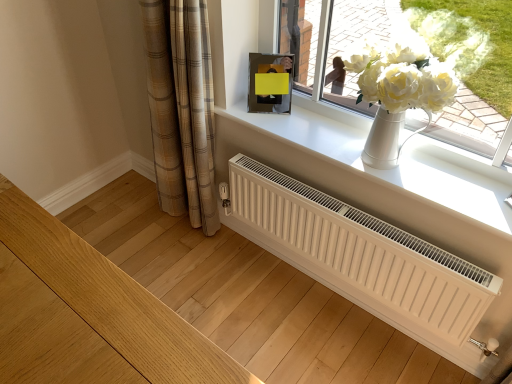
Question: Which direction should I rotate to look at metallic reflective picture frame at upper center?

Choices:
 (A) left
 (B) right

Answer: (B)

Question: Is white matte radiator at center outside of metallic reflective picture frame at upper center?

Choices:
 (A) no
 (B) yes

Answer: (B)

Question: From a real-world perspective, is white matte radiator at center below metallic reflective picture frame at upper center?

Choices:
 (A) no
 (B) yes

Answer: (B)

Question: Can you confirm if white matte radiator at center is positioned to the right of metallic reflective picture frame at upper center?

Choices:
 (A) yes
 (B) no

Answer: (A)

Question: Considering the relative positions of white matte radiator at center and metallic reflective picture frame at upper center in the image provided, is white matte radiator at center behind metallic reflective picture frame at upper center?

Choices:
 (A) no
 (B) yes

Answer: (A)

Question: Is white matte radiator at center facing away from metallic reflective picture frame at upper center?

Choices:
 (A) no
 (B) yes

Answer: (A)

Question: Considering the relative sizes of white matte radiator at center and metallic reflective picture frame at upper center in the image provided, is white matte radiator at center smaller than metallic reflective picture frame at upper center?

Choices:
 (A) yes
 (B) no

Answer: (B)

Question: Is white ceramic vase at upper center turned away from white smooth window sill at upper center?

Choices:
 (A) yes
 (B) no

Answer: (B)

Question: Considering the relative sizes of white ceramic vase at upper center and white smooth window sill at upper center in the image provided, is white ceramic vase at upper center thinner than white smooth window sill at upper center?

Choices:
 (A) no
 (B) yes

Answer: (B)

Question: From the image's perspective, is white ceramic vase at upper center located beneath white smooth window sill at upper center?

Choices:
 (A) yes
 (B) no

Answer: (B)

Question: Considering the relative sizes of white ceramic vase at upper center and white smooth window sill at upper center in the image provided, is white ceramic vase at upper center shorter than white smooth window sill at upper center?

Choices:
 (A) no
 (B) yes

Answer: (A)

Question: Is white ceramic vase at upper center oriented towards white smooth window sill at upper center?

Choices:
 (A) yes
 (B) no

Answer: (A)

Question: Considering the relative sizes of white ceramic vase at upper center and white smooth window sill at upper center in the image provided, is white ceramic vase at upper center wider than white smooth window sill at upper center?

Choices:
 (A) no
 (B) yes

Answer: (A)

Question: From the image's perspective, would you say plaid fabric curtain at lower left is shown under white matte radiator at center?

Choices:
 (A) no
 (B) yes

Answer: (A)